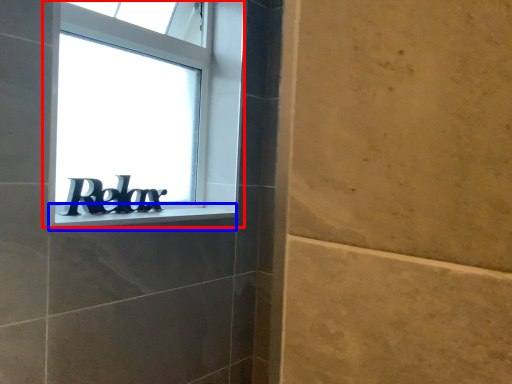
Question: Which object is closer to the camera taking this photo, window (highlighted by a red box) or window sill (highlighted by a blue box)?

Choices:
 (A) window
 (B) window sill

Answer: (B)